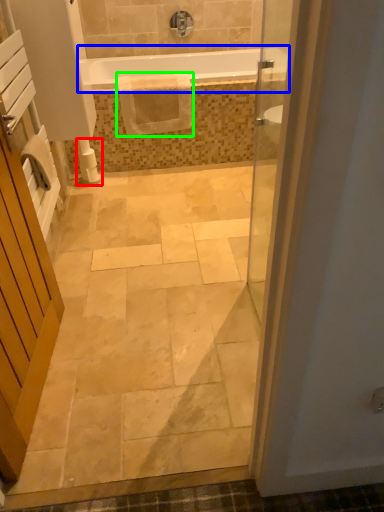
Question: Which object is the farthest from toilet paper (highlighted by a red box)? Choose among these: bathtub (highlighted by a blue box) or material (highlighted by a green box).

Choices:
 (A) bathtub
 (B) material

Answer: (A)